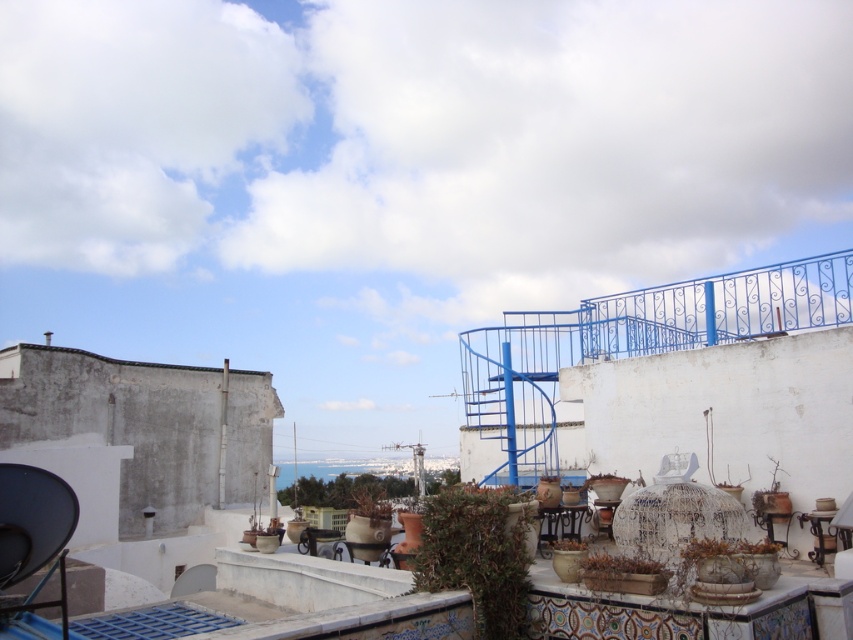
Question: Is brown wooden planter at center to the left of green matte plant at lower right from the viewer's perspective?

Choices:
 (A) no
 (B) yes

Answer: (B)

Question: Can you confirm if brown wooden planter at center is bigger than green matte plant at lower right?

Choices:
 (A) yes
 (B) no

Answer: (A)

Question: Which object is the closest to the green matte plant at center?

Choices:
 (A) green matte plant at lower right
 (B) brown wooden planter at center

Answer: (B)

Question: Estimate the real-world distances between objects in this image. Which object is closer to the green matte plant at lower right?

Choices:
 (A) brown wooden planter at center
 (B) green matte plant at center

Answer: (A)

Question: Which of these objects is positioned farthest from the brown wooden planter at center?

Choices:
 (A) green matte plant at center
 (B) green matte plant at lower right

Answer: (B)

Question: Considering the relative positions of brown wooden planter at center and green matte plant at lower right in the image provided, where is brown wooden planter at center located with respect to green matte plant at lower right?

Choices:
 (A) left
 (B) right

Answer: (A)